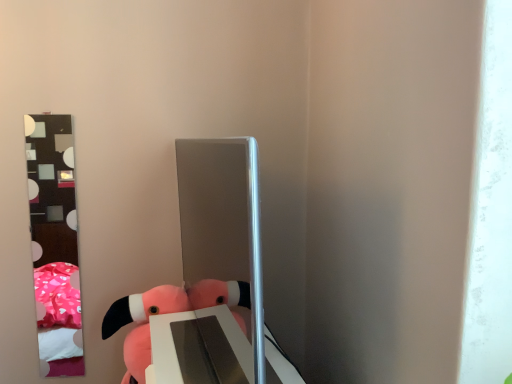
Question: Does pink plush toy at lower left have a greater height compared to satin silver mirror at center?

Choices:
 (A) yes
 (B) no

Answer: (B)

Question: Does pink plush toy at lower left have a larger size compared to satin silver mirror at center?

Choices:
 (A) yes
 (B) no

Answer: (B)

Question: Is pink plush toy at lower left surrounding satin silver mirror at center?

Choices:
 (A) no
 (B) yes

Answer: (A)

Question: Is pink plush toy at lower left further to camera compared to satin silver mirror at center?

Choices:
 (A) yes
 (B) no

Answer: (A)

Question: Does pink plush toy at lower left have a lesser width compared to satin silver mirror at center?

Choices:
 (A) yes
 (B) no

Answer: (B)

Question: Is pink plush toy at lower left shorter than satin silver mirror at center?

Choices:
 (A) no
 (B) yes

Answer: (B)

Question: From the image's perspective, is metallic reflective mirror at left on satin silver mirror at center?

Choices:
 (A) no
 (B) yes

Answer: (A)

Question: Is metallic reflective mirror at left aimed at satin silver mirror at center?

Choices:
 (A) yes
 (B) no

Answer: (B)

Question: Can you confirm if metallic reflective mirror at left is bigger than satin silver mirror at center?

Choices:
 (A) no
 (B) yes

Answer: (A)

Question: Is metallic reflective mirror at left to the right of satin silver mirror at center from the viewer's perspective?

Choices:
 (A) no
 (B) yes

Answer: (A)

Question: Is metallic reflective mirror at left not near satin silver mirror at center?

Choices:
 (A) no
 (B) yes

Answer: (B)

Question: From the image's perspective, does metallic reflective mirror at left appear lower than satin silver mirror at center?

Choices:
 (A) yes
 (B) no

Answer: (A)

Question: Is metallic reflective mirror at left shorter than pink plush toy at lower left?

Choices:
 (A) no
 (B) yes

Answer: (A)